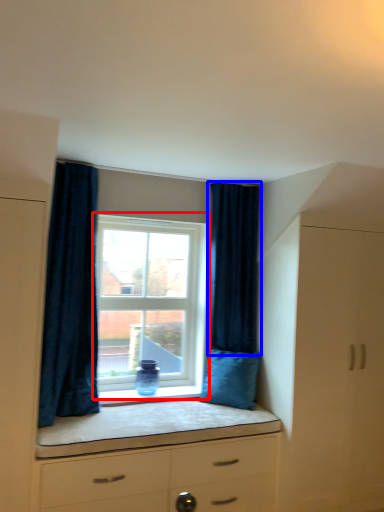
Question: Which object is closer to the camera taking this photo, window (highlighted by a red box) or curtain (highlighted by a blue box)?

Choices:
 (A) window
 (B) curtain

Answer: (B)